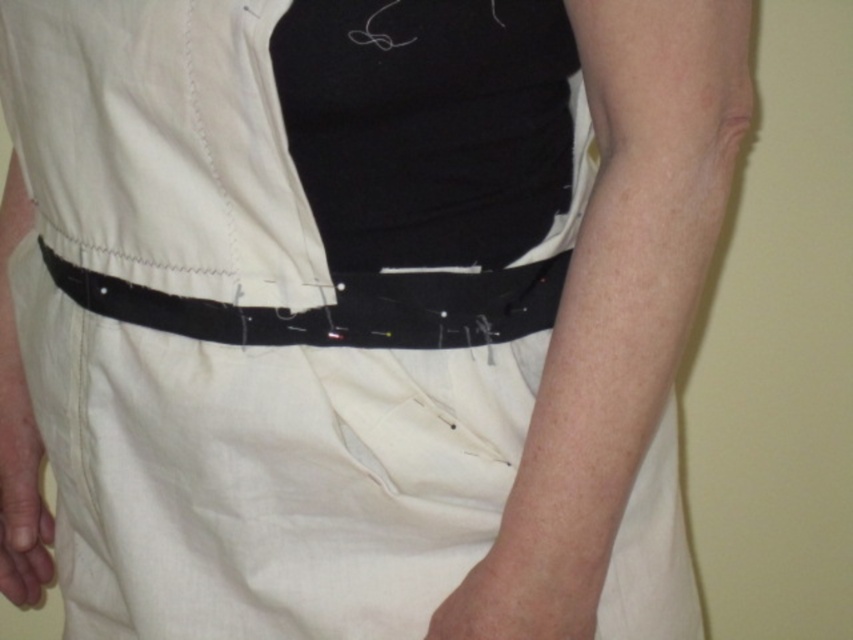
Does smooth skin at lower center have a smaller size compared to smooth beige hand at lower left?

Correct, smooth skin at lower center occupies less space than smooth beige hand at lower left.

Does smooth skin at lower center appear over smooth beige hand at lower left?

Incorrect, smooth skin at lower center is not positioned above smooth beige hand at lower left.

Who is more distant from viewer, (596, 595) or (32, 412)?

The point (32, 412) is more distant.

Identify the location of smooth skin at lower center. This screenshot has height=640, width=853. (526, 589).

Is matte white shirt at center below smooth beige hand at lower left?

Incorrect, matte white shirt at center is not positioned below smooth beige hand at lower left.

Who is positioned more to the left, matte white shirt at center or smooth beige hand at lower left?

Positioned to the left is smooth beige hand at lower left.

Where is `matte white shirt at center`? The height and width of the screenshot is (640, 853). matte white shirt at center is located at coordinates pos(207,140).

Does point (262, 243) come closer to viewer compared to point (523, 604)?

That is False.

Find the location of a particular element. This screenshot has width=853, height=640. matte white shirt at center is located at coordinates (207, 140).